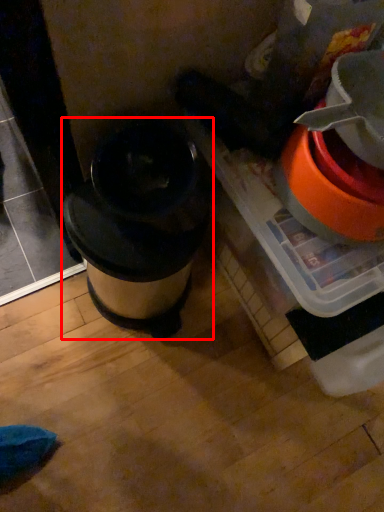
Question: In this image, where is waste container (annotated by the red box) located relative to appliance?

Choices:
 (A) right
 (B) left

Answer: (B)